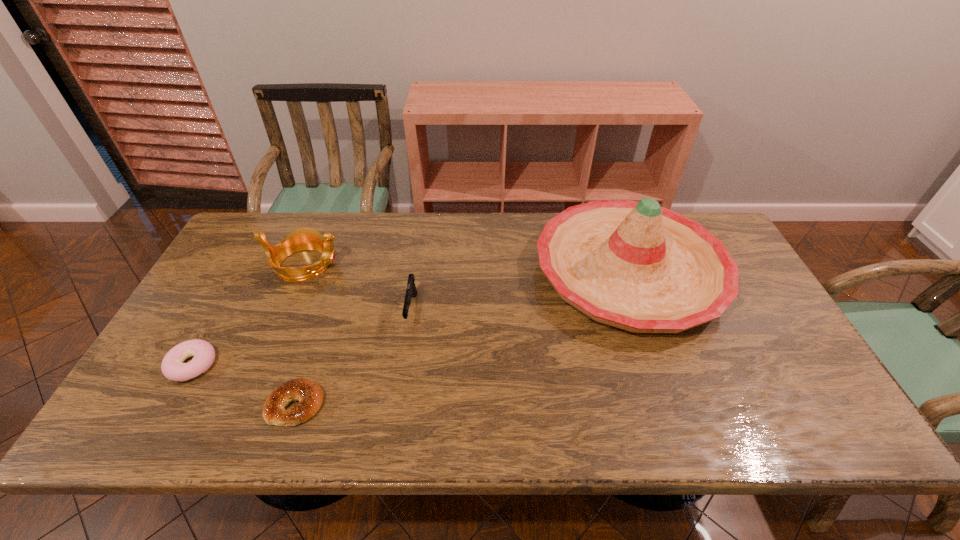
What are the coordinates of `vacant space that's between the tallest object and the bagel` in the screenshot? It's located at (463, 338).

You are a GUI agent. You are given a task and a screenshot of the screen. Output one action in this format:
    pyautogui.click(x=<x>, y=<y>)
    Task: Click on the vacant area that lies between the bagel and the leftmost object
    
    Given the screenshot: What is the action you would take?
    tap(244, 384)

You are a GUI agent. You are given a task and a screenshot of the screen. Output one action in this format:
    pyautogui.click(x=<x>, y=<y>)
    Task: Click on the free space between the tiara and the tallest object
    The image size is (960, 540).
    Given the screenshot: What is the action you would take?
    pyautogui.click(x=467, y=268)

Where is `free space between the tiara and the leftmost object`? free space between the tiara and the leftmost object is located at coordinates (249, 315).

This screenshot has height=540, width=960. Find the location of `object that is the fourth closest one to the gun`. object that is the fourth closest one to the gun is located at coordinates (172, 366).

This screenshot has height=540, width=960. In order to click on the third closest object to the bagel in this screenshot , I will do click(x=305, y=238).

Find the location of a particular element. The height and width of the screenshot is (540, 960). free space that satisfies the following two spatial constraints: 1. on the back side of the bagel; 2. at the front emblem of the tiara is located at coordinates (343, 265).

Identify the location of vacant space that satisfies the following two spatial constraints: 1. on the back side of the rightmost object; 2. on the left side of the bagel. Image resolution: width=960 pixels, height=540 pixels. (340, 272).

Identify the location of vacant space that satisfies the following two spatial constraints: 1. on the front side of the bagel; 2. on the right side of the leftmost object. click(x=170, y=404).

Find the location of a particular element. free region that satisfies the following two spatial constraints: 1. on the back side of the bagel; 2. on the right side of the sombrero is located at coordinates (340, 272).